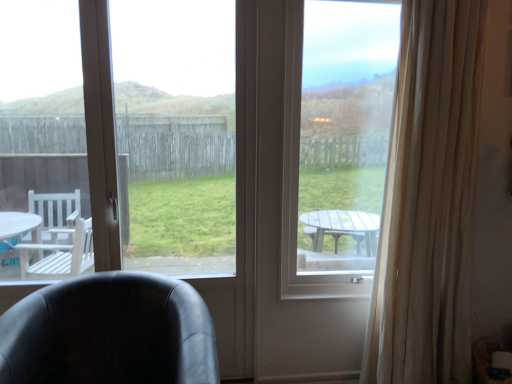
Question: From the image's perspective, is black leather chair at lower left on top of transparent glass window at center, placed as the second window screen when sorted from right to left?

Choices:
 (A) no
 (B) yes

Answer: (A)

Question: Considering the relative sizes of black leather chair at lower left and transparent glass window at center, placed as the second window screen when sorted from right to left, in the image provided, is black leather chair at lower left wider than transparent glass window at center, placed as the second window screen when sorted from right to left,?

Choices:
 (A) no
 (B) yes

Answer: (B)

Question: Can you confirm if black leather chair at lower left is shorter than transparent glass window at center, placed as the second window screen when sorted from right to left?

Choices:
 (A) no
 (B) yes

Answer: (B)

Question: From a real-world perspective, is black leather chair at lower left physically above transparent glass window at center, which ranks as the 1th window screen in left-to-right order?

Choices:
 (A) no
 (B) yes

Answer: (A)

Question: Is black leather chair at lower left positioned before transparent glass window at center, which ranks as the 1th window screen in left-to-right order?

Choices:
 (A) yes
 (B) no

Answer: (A)

Question: Considering their positions, is transparent glass window at center, the first window screen from the right, located in front of or behind beige sheer curtain at right?

Choices:
 (A) behind
 (B) front

Answer: (A)

Question: Is transparent glass window at center, the first window screen from the right, taller or shorter than beige sheer curtain at right?

Choices:
 (A) short
 (B) tall

Answer: (A)

Question: Considering the positions of transparent glass window at center, the first window screen from the right, and beige sheer curtain at right in the image, is transparent glass window at center, the first window screen from the right, wider or thinner than beige sheer curtain at right?

Choices:
 (A) wide
 (B) thin

Answer: (B)

Question: Is point (366, 276) closer or farther from the camera than point (413, 370)?

Choices:
 (A) farther
 (B) closer

Answer: (A)

Question: From the image's perspective, is beige sheer curtain at right above or below transparent glass window at center, placed as the second window screen when sorted from right to left?

Choices:
 (A) below
 (B) above

Answer: (A)

Question: Is beige sheer curtain at right in front of or behind transparent glass window at center, which ranks as the 1th window screen in left-to-right order, in the image?

Choices:
 (A) behind
 (B) front

Answer: (B)

Question: Do you think beige sheer curtain at right is within transparent glass window at center, which ranks as the 1th window screen in left-to-right order, or outside of it?

Choices:
 (A) outside
 (B) inside

Answer: (A)

Question: Considering the positions of beige sheer curtain at right and transparent glass window at center, which ranks as the 1th window screen in left-to-right order, in the image, is beige sheer curtain at right wider or thinner than transparent glass window at center, which ranks as the 1th window screen in left-to-right order,?

Choices:
 (A) wide
 (B) thin

Answer: (A)

Question: Visually, is transparent glass window at center, placed as the second window screen when sorted from right to left, positioned to the left or to the right of black leather chair at lower left?

Choices:
 (A) right
 (B) left

Answer: (A)

Question: Considering the positions of transparent glass window at center, placed as the second window screen when sorted from right to left, and black leather chair at lower left in the image, is transparent glass window at center, placed as the second window screen when sorted from right to left, taller or shorter than black leather chair at lower left?

Choices:
 (A) short
 (B) tall

Answer: (B)